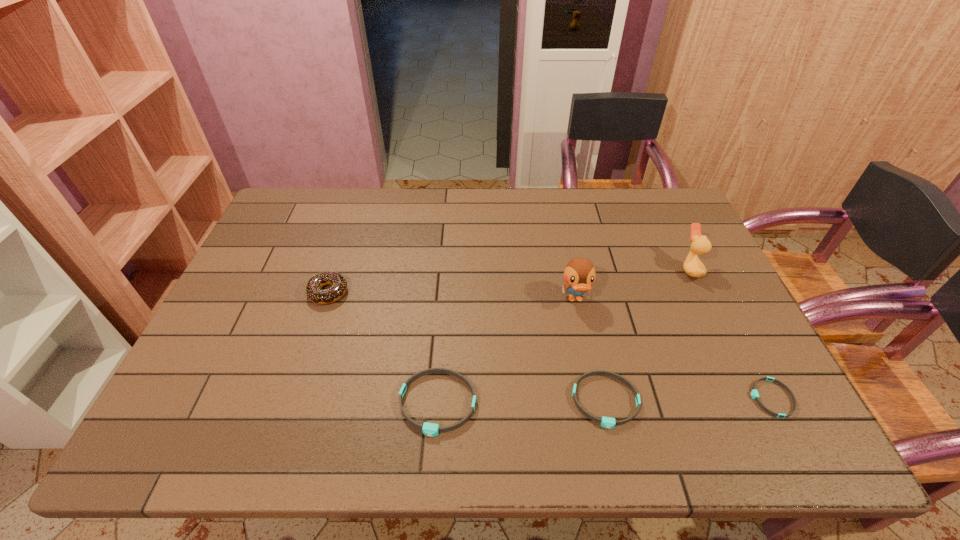
Locate an element on the screen. This screenshot has height=540, width=960. vacant space positioned 0.290m on the buckle of the shortest object is located at coordinates (625, 398).

What are the coordinates of `free space located on the buckle of the shortest object` in the screenshot? It's located at (607, 398).

At what (x,y) coordinates should I click in order to perform the action: click on free space located 0.210m on the right of the fourth shortest object. Please return your answer as a coordinate pair (x, y). Looking at the image, I should click on (422, 292).

Where is `vacant position located on the front-facing side of the nearer duck`? vacant position located on the front-facing side of the nearer duck is located at coordinates (593, 386).

Locate an element on the screen. free space located on the beak of the farther duck is located at coordinates (619, 269).

You are a GUI agent. You are given a task and a screenshot of the screen. Output one action in this format:
    pyautogui.click(x=<x>, y=<y>)
    Task: Click on the vacant region located on the beak of the farther duck
    
    Given the screenshot: What is the action you would take?
    pyautogui.click(x=568, y=269)

Identify the location of vacant space positioned 0.390m on the beak of the farther duck. (548, 269).

At what (x,y) coordinates should I click in order to perform the action: click on wristband positioned at the right edge. Please return your answer as a coordinate pair (x, y). The image size is (960, 540). Looking at the image, I should click on (754, 393).

Find the location of a particular element. The height and width of the screenshot is (540, 960). duck at the right edge is located at coordinates (700, 245).

The height and width of the screenshot is (540, 960). Find the location of `object located in the near right corner section of the desktop`. object located in the near right corner section of the desktop is located at coordinates (754, 393).